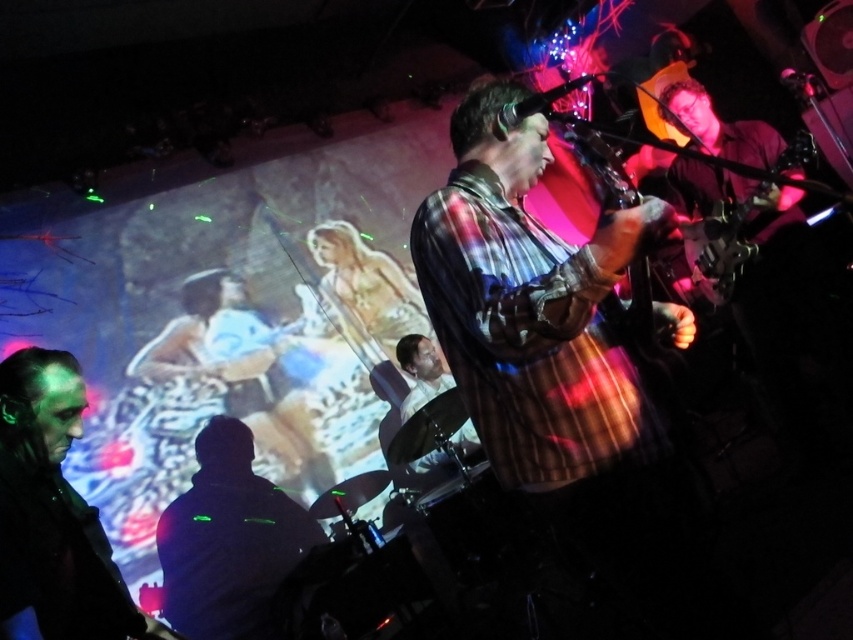
Question: Which point is closer to the camera?

Choices:
 (A) (606, 332)
 (B) (740, 236)

Answer: (A)

Question: Can you confirm if plaid shirt guitar at center is thinner than metallic guitar at center?

Choices:
 (A) yes
 (B) no

Answer: (B)

Question: Can you confirm if plaid shirt guitar at center is bigger than metallic guitar at center?

Choices:
 (A) yes
 (B) no

Answer: (A)

Question: Is plaid shirt guitar at center wider than metallic guitar at center?

Choices:
 (A) yes
 (B) no

Answer: (A)